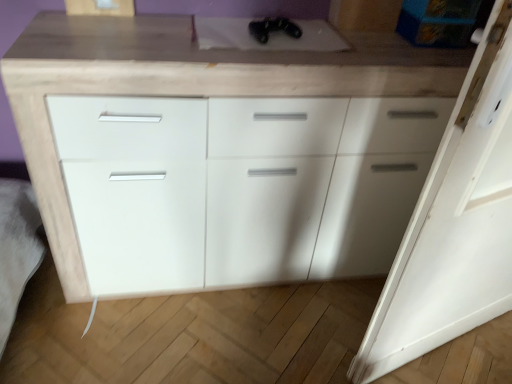
This screenshot has width=512, height=384. Find the location of `empty space that is ontop of white matte cabinet at center`. empty space that is ontop of white matte cabinet at center is located at coordinates (240, 39).